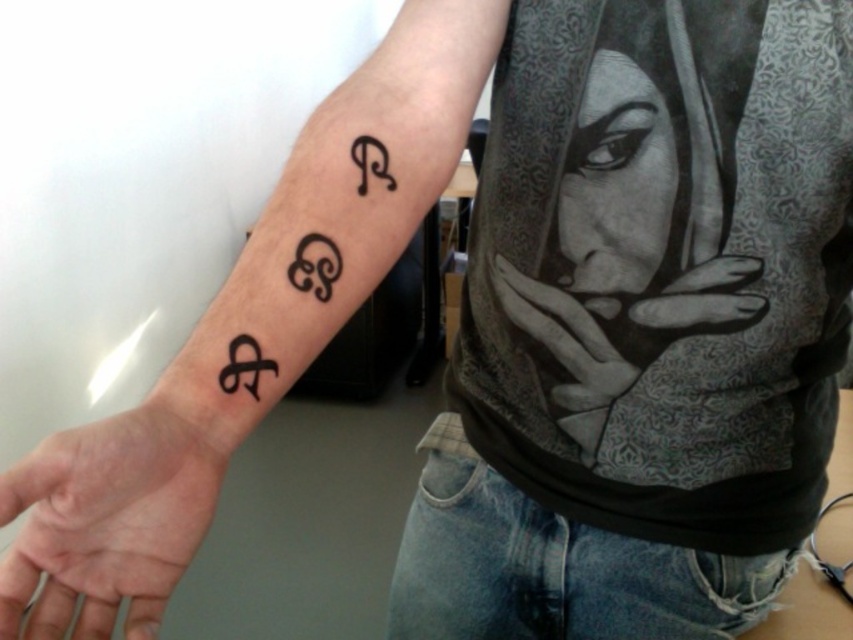
You are a tattoo artist examining the forearm of a client. You notice the black ink tattoo at upper right and the black matte hand at center. Which object is located higher on the forearm?

The black ink tattoo at upper right is located higher on the forearm than the black matte hand at center because it is positioned above it.

You are a tattoo artist reviewing a client who has two black ink tattoos on their forearm. The client wants to add a third tattoo between the existing ones. Based on their current positions, which tattoo should be closer to the wrist? The tattoos are the black ink tattoo at center and the black ink symbol at upper center.

The black ink tattoo at center should be closer to the wrist because it is positioned below the black ink symbol at upper center.

From the picture: You are standing 6 feet away from the person. Can you clearly see the tattoo at point (189, 492) on their forearm?

Point (189, 492) is 16.67 inches from the viewer. Since you are standing 6 feet away, which is 72 inches, the distance is sufficient to see the tattoo clearly as it is within a reasonable viewing range.